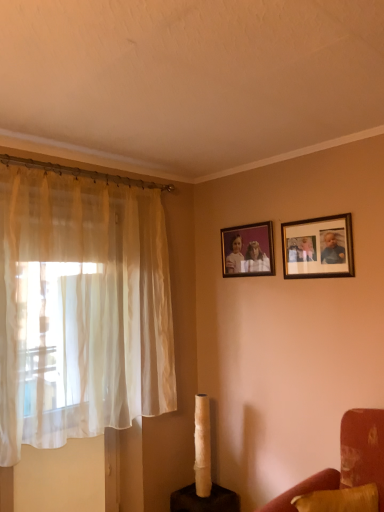
Question: Is velvet red couch at lower right closer to camera compared to sheer white curtain at left?

Choices:
 (A) no
 (B) yes

Answer: (B)

Question: Is velvet red couch at lower right turned away from sheer white curtain at left?

Choices:
 (A) no
 (B) yes

Answer: (A)

Question: Does velvet red couch at lower right appear on the left side of sheer white curtain at left?

Choices:
 (A) yes
 (B) no

Answer: (B)

Question: Considering the relative sizes of velvet red couch at lower right and sheer white curtain at left in the image provided, is velvet red couch at lower right shorter than sheer white curtain at left?

Choices:
 (A) yes
 (B) no

Answer: (A)

Question: Is sheer white curtain at left inside velvet red couch at lower right?

Choices:
 (A) yes
 (B) no

Answer: (B)

Question: In the image, is velvet red couch at lower right on the left side or the right side of wooden photo frame at upper right, marked as the 1th picture frame in a front-to-back arrangement?

Choices:
 (A) left
 (B) right

Answer: (A)

Question: Is point (276, 510) closer or farther from the camera than point (319, 222)?

Choices:
 (A) closer
 (B) farther

Answer: (A)

Question: Is velvet red couch at lower right taller or shorter than wooden photo frame at upper right, which appears as the 1th picture frame when viewed from the right?

Choices:
 (A) short
 (B) tall

Answer: (A)

Question: In terms of width, does velvet red couch at lower right look wider or thinner when compared to wooden photo frame at upper right, the second picture frame viewed from the back?

Choices:
 (A) thin
 (B) wide

Answer: (B)

Question: Do you think wooden photo frame at upper right, the second picture frame viewed from the back, is within velvet red armchair at lower right, or outside of it?

Choices:
 (A) inside
 (B) outside

Answer: (B)

Question: Considering the positions of wooden photo frame at upper right, marked as the 1th picture frame in a front-to-back arrangement, and velvet red armchair at lower right in the image, is wooden photo frame at upper right, marked as the 1th picture frame in a front-to-back arrangement, wider or thinner than velvet red armchair at lower right?

Choices:
 (A) wide
 (B) thin

Answer: (B)

Question: From the image's perspective, is wooden photo frame at upper right, the second picture frame when ordered from left to right, located above or below velvet red armchair at lower right?

Choices:
 (A) below
 (B) above

Answer: (B)

Question: Is point (288, 233) positioned closer to the camera than point (322, 483)?

Choices:
 (A) closer
 (B) farther

Answer: (B)

Question: Is point (317, 480) closer or farther from the camera than point (299, 234)?

Choices:
 (A) closer
 (B) farther

Answer: (A)

Question: Considering the positions of velvet red armchair at lower right and wooden photo frame at upper right, the second picture frame when ordered from left to right, in the image, is velvet red armchair at lower right wider or thinner than wooden photo frame at upper right, the second picture frame when ordered from left to right,?

Choices:
 (A) thin
 (B) wide

Answer: (B)